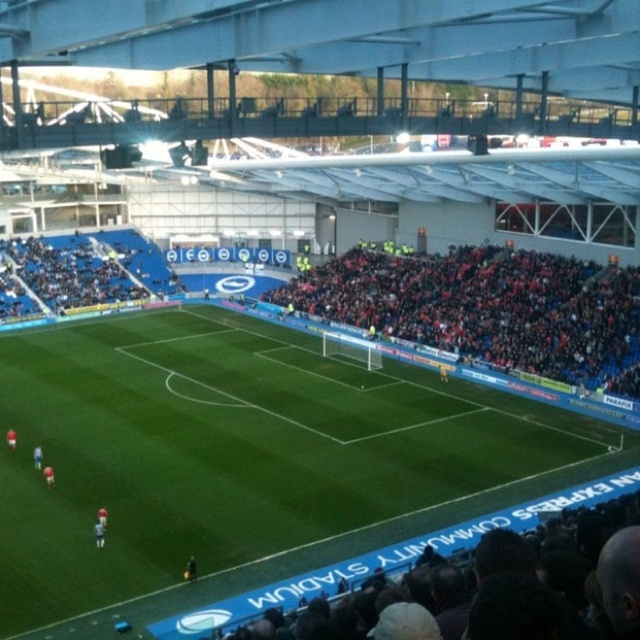
Question: Based on their relative distances, which object is farther from the white jersey player at center?

Choices:
 (A) red jersey at lower left
 (B) black fabric person at center
 (C) red fabric crowd at center

Answer: (C)

Question: Among these objects, which one is nearest to the camera?

Choices:
 (A) red fabric crowd at center
 (B) black fabric person at center
 (C) green grass football field at center

Answer: (C)

Question: Is green jersey at lower left bigger than red jersey at lower left?

Choices:
 (A) no
 (B) yes

Answer: (A)

Question: Does red fabric crowd at center appear over red jersey at lower left?

Choices:
 (A) yes
 (B) no

Answer: (A)

Question: From the image, what is the correct spatial relationship of white matte soccer player at lower left in relation to red jersey at lower left?

Choices:
 (A) right
 (B) left

Answer: (A)

Question: Among these objects, which one is farthest from the camera?

Choices:
 (A) black fabric person at center
 (B) blue jersey at center
 (C) red fabric crowd at center
 (D) white jersey player at center

Answer: (C)